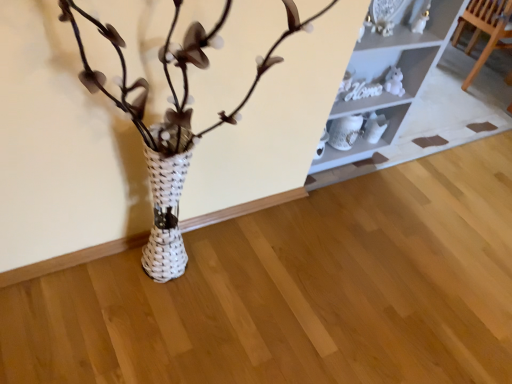
Question: Is white glossy shelf at upper center in front of or behind wooden chair at upper right in the image?

Choices:
 (A) front
 (B) behind

Answer: (A)

Question: From the image's perspective, is white glossy shelf at upper center positioned above or below wooden chair at upper right?

Choices:
 (A) below
 (B) above

Answer: (A)

Question: Choose the correct answer: Is white glossy shelf at upper center inside wooden chair at upper right or outside it?

Choices:
 (A) inside
 (B) outside

Answer: (B)

Question: Considering the positions of wooden chair at upper right and white glossy shelf at upper center in the image, is wooden chair at upper right wider or thinner than white glossy shelf at upper center?

Choices:
 (A) thin
 (B) wide

Answer: (A)

Question: Considering the relative positions of wooden chair at upper right and white glossy shelf at upper center in the image provided, is wooden chair at upper right to the left or to the right of white glossy shelf at upper center?

Choices:
 (A) left
 (B) right

Answer: (B)

Question: From a real-world perspective, is wooden chair at upper right positioned above or below white glossy shelf at upper center?

Choices:
 (A) below
 (B) above

Answer: (A)

Question: Is wooden chair at upper right inside the boundaries of white glossy shelf at upper center, or outside?

Choices:
 (A) inside
 (B) outside

Answer: (B)